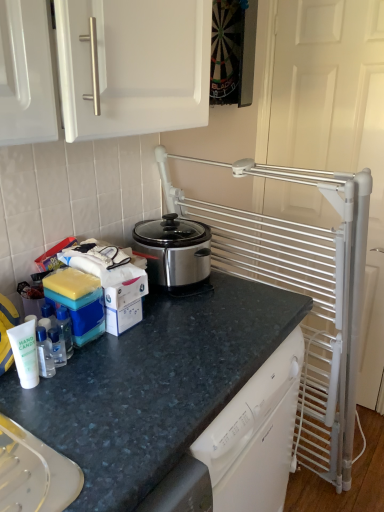
Question: Does clear plastic bottle at lower left, which is the 3th bottle from back to front, lie behind granite dark blue countertop at center?

Choices:
 (A) no
 (B) yes

Answer: (B)

Question: Can you confirm if clear plastic bottle at lower left, marked as the second bottle in a front-to-back arrangement, is thinner than granite dark blue countertop at center?

Choices:
 (A) no
 (B) yes

Answer: (B)

Question: From the image's perspective, is clear plastic bottle at lower left, marked as the second bottle in a front-to-back arrangement, located beneath granite dark blue countertop at center?

Choices:
 (A) yes
 (B) no

Answer: (B)

Question: Considering the relative sizes of clear plastic bottle at lower left, which is the 3th bottle from back to front, and granite dark blue countertop at center in the image provided, is clear plastic bottle at lower left, which is the 3th bottle from back to front, taller than granite dark blue countertop at center?

Choices:
 (A) yes
 (B) no

Answer: (B)

Question: Considering the relative sizes of clear plastic bottle at lower left, marked as the second bottle in a front-to-back arrangement, and granite dark blue countertop at center in the image provided, is clear plastic bottle at lower left, marked as the second bottle in a front-to-back arrangement, smaller than granite dark blue countertop at center?

Choices:
 (A) yes
 (B) no

Answer: (A)

Question: From a real-world perspective, is clear plastic bottle at lower left, marked as the second bottle in a front-to-back arrangement, over granite dark blue countertop at center?

Choices:
 (A) yes
 (B) no

Answer: (A)

Question: From a real-world perspective, is clear plastic bottle at lower left, marked as the second bottle in a front-to-back arrangement, positioned over white metal screen door at right based on gravity?

Choices:
 (A) no
 (B) yes

Answer: (A)

Question: Could you tell me if clear plastic bottle at lower left, marked as the second bottle in a front-to-back arrangement, is turned towards white metal screen door at right?

Choices:
 (A) yes
 (B) no

Answer: (B)

Question: Can we say clear plastic bottle at lower left, marked as the second bottle in a front-to-back arrangement, lies outside white metal screen door at right?

Choices:
 (A) yes
 (B) no

Answer: (A)

Question: Does clear plastic bottle at lower left, which is the 3th bottle from back to front, have a lesser height compared to white metal screen door at right?

Choices:
 (A) no
 (B) yes

Answer: (B)

Question: From a real-world perspective, is clear plastic bottle at lower left, marked as the second bottle in a front-to-back arrangement, located beneath white metal screen door at right?

Choices:
 (A) yes
 (B) no

Answer: (A)

Question: Is clear plastic bottle at lower left, marked as the second bottle in a front-to-back arrangement, in front of white metal screen door at right?

Choices:
 (A) no
 (B) yes

Answer: (B)

Question: Considering the relative sizes of clear plastic bottle at lower left, which is the 3th bottle from back to front, and clear plastic bottle at left, the first bottle viewed from the back, in the image provided, is clear plastic bottle at lower left, which is the 3th bottle from back to front, thinner than clear plastic bottle at left, the first bottle viewed from the back,?

Choices:
 (A) no
 (B) yes

Answer: (A)